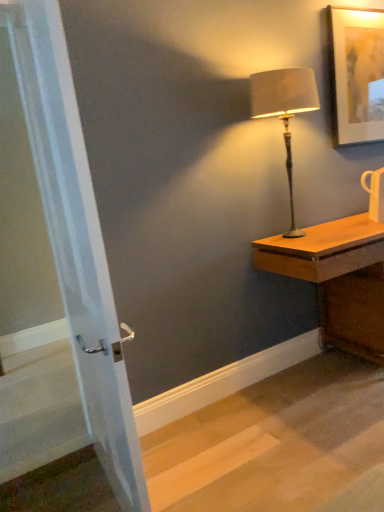
Where is `vacant area that lies to the right of white glossy screen door at left`? The width and height of the screenshot is (384, 512). vacant area that lies to the right of white glossy screen door at left is located at coordinates (224, 473).